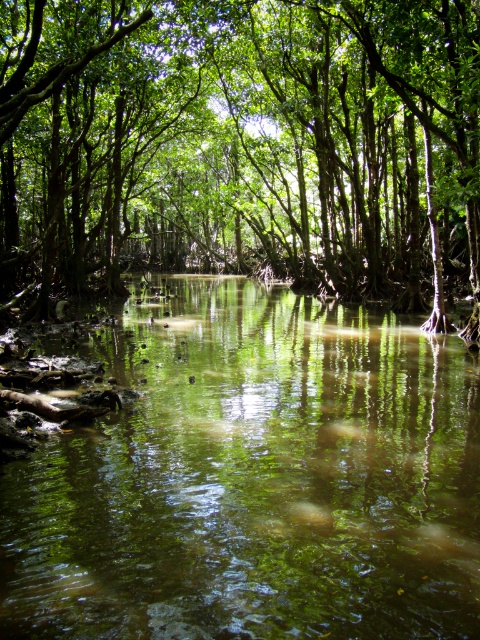
You are a kayaker navigating a narrow waterway in the mangrove forest. You see the point marked at coordinates (253, 477). What is located at that point?

The point at coordinates (253, 477) is occupied by green reflective water at center.

In the serene mangrove forest scene, you notice the green reflective water at center and the green leafy tree at center. Which one has a smaller width?

The green reflective water at center has a smaller width than the green leafy tree at center.

You are a kayaker navigating through the mangrove forest. You see the green reflective water at center and the green leafy tree at center. Which one is located to the right when facing the scene?

The green reflective water at center is positioned on the right side of green leafy tree at center, so when facing the scene, the green reflective water at center is to the right of the green leafy tree at center.